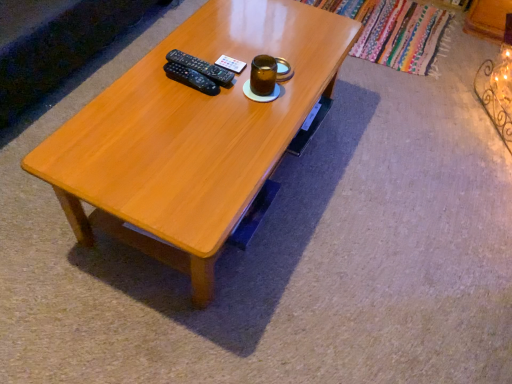
In order to click on blank space situated above light brown wood coffee table at center (from a real-world perspective) in this screenshot , I will do `click(188, 107)`.